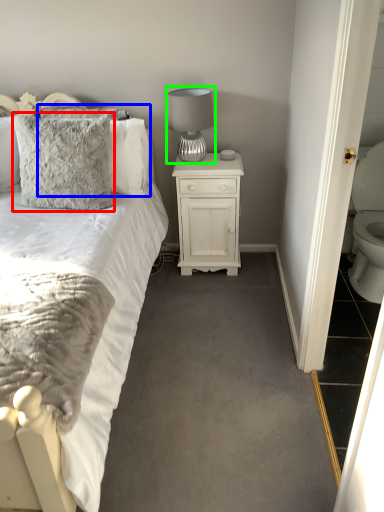
Question: Which is farther away from pillow (highlighted by a red box)? pillow (highlighted by a blue box) or table lamp (highlighted by a green box)?

Choices:
 (A) pillow
 (B) table lamp

Answer: (B)